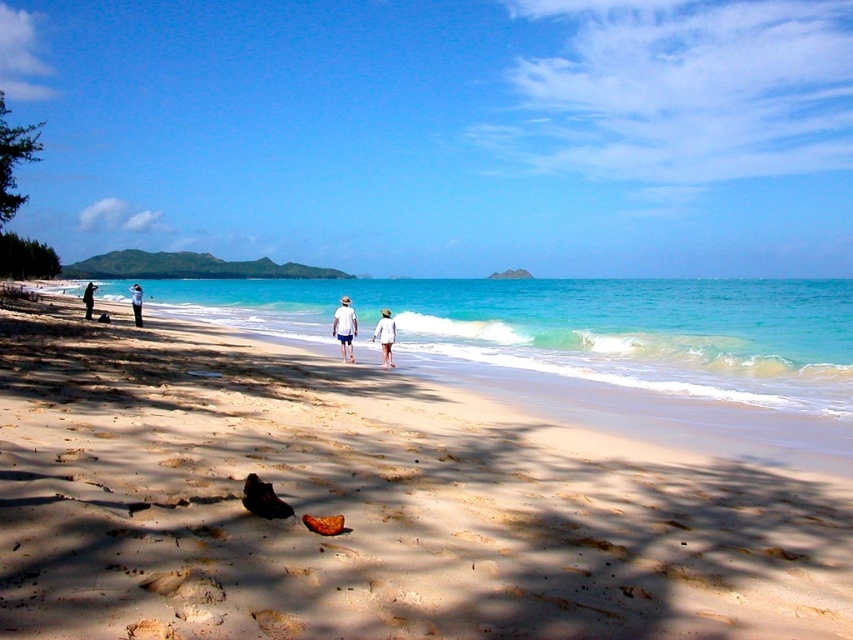
Between point (830, 356) and point (380, 333), which one is positioned in front?

Positioned in front is point (380, 333).

Who is higher up, clear blue water at center or white cotton hat at center?

clear blue water at center

The height and width of the screenshot is (640, 853). Identify the location of clear blue water at center. click(x=573, y=328).

Where is `clear blue water at center`? The height and width of the screenshot is (640, 853). clear blue water at center is located at coordinates (573, 328).

Does clear blue water at center have a larger size compared to white matte clothing at center?

Correct, clear blue water at center is larger in size than white matte clothing at center.

Who is more forward, (746, 292) or (344, 360)?

Point (344, 360) is in front.

This screenshot has width=853, height=640. Find the location of `clear blue water at center`. clear blue water at center is located at coordinates (573, 328).

Can you confirm if white cotton hat at center is taller than dark blue jeans at left?

No, white cotton hat at center is not taller than dark blue jeans at left.

Does white cotton hat at center have a larger size compared to dark blue jeans at left?

No.

This screenshot has height=640, width=853. Find the location of `white cotton hat at center`. white cotton hat at center is located at coordinates (386, 337).